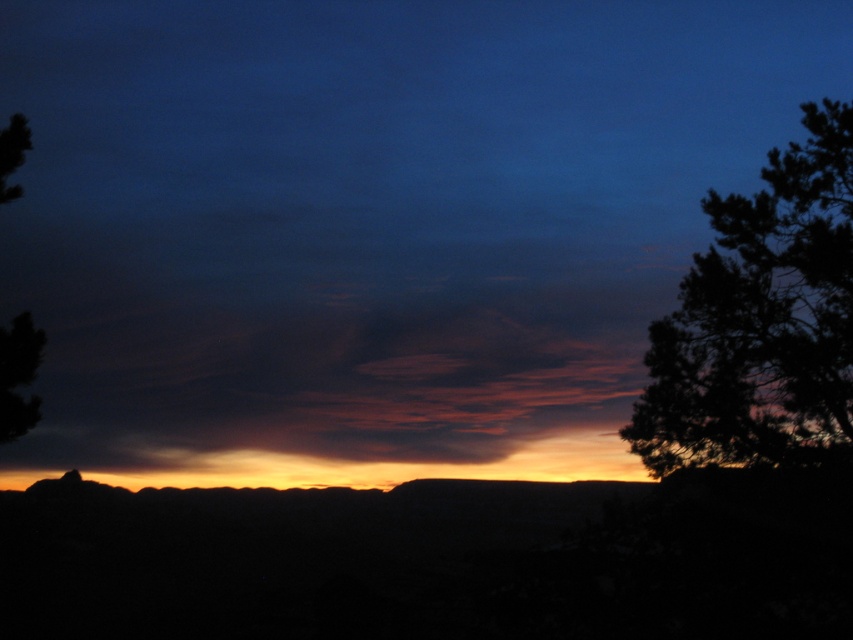
Question: Is the position of dark green textured tree at right more distant than that of dark green leafy tree at left?

Choices:
 (A) no
 (B) yes

Answer: (B)

Question: Is dark green textured tree at right to the right of dark green leafy tree at left from the viewer's perspective?

Choices:
 (A) yes
 (B) no

Answer: (A)

Question: Which point appears farthest from the camera in this image?

Choices:
 (A) (850, 108)
 (B) (7, 358)

Answer: (A)

Question: Does dark green textured tree at right appear over dark green leafy tree at left?

Choices:
 (A) yes
 (B) no

Answer: (A)